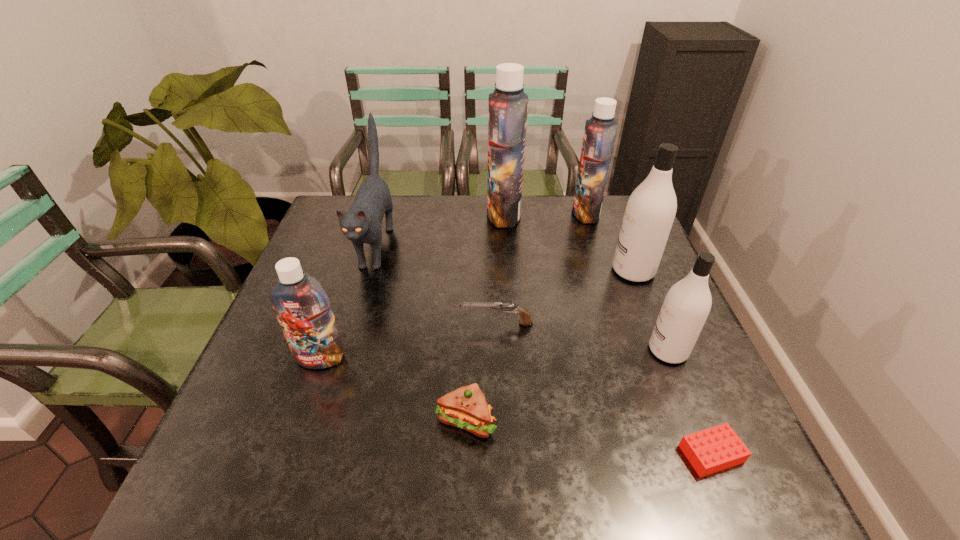
In order to click on vacant space located aiming along the barrel of the eighth tallest object in this screenshot , I will do `click(406, 323)`.

This screenshot has width=960, height=540. I want to click on free location located 0.150m on the back of the shortest object, so click(x=676, y=369).

Identify the location of cat that is positioned at the far edge. The height and width of the screenshot is (540, 960). (361, 224).

This screenshot has width=960, height=540. I want to click on object positioned at the near edge, so click(714, 449).

At what (x,y) coordinates should I click in order to perform the action: click on cat that is positioned at the left edge. Please return your answer as a coordinate pair (x, y). Looking at the image, I should click on (361, 224).

Identify the location of shampoo at the left edge. (302, 307).

At what (x,y) coordinates should I click in order to perform the action: click on Lego that is at the right edge. Please return your answer as a coordinate pair (x, y). Looking at the image, I should click on (714, 449).

The height and width of the screenshot is (540, 960). I want to click on object that is at the far left corner, so click(361, 224).

The height and width of the screenshot is (540, 960). In order to click on object at the far right corner in this screenshot , I will do `click(600, 131)`.

In order to click on object at the near right corner in this screenshot , I will do `click(714, 449)`.